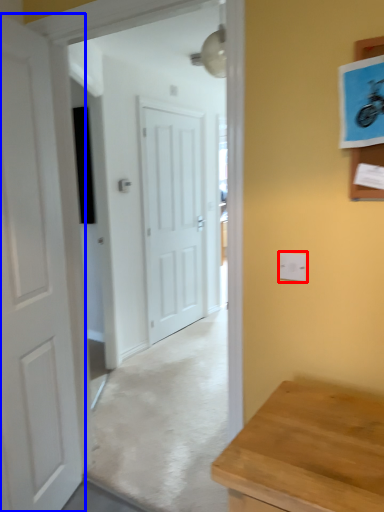
Question: Which object is closer to the camera taking this photo, electric outlet (highlighted by a red box) or door (highlighted by a blue box)?

Choices:
 (A) electric outlet
 (B) door

Answer: (B)